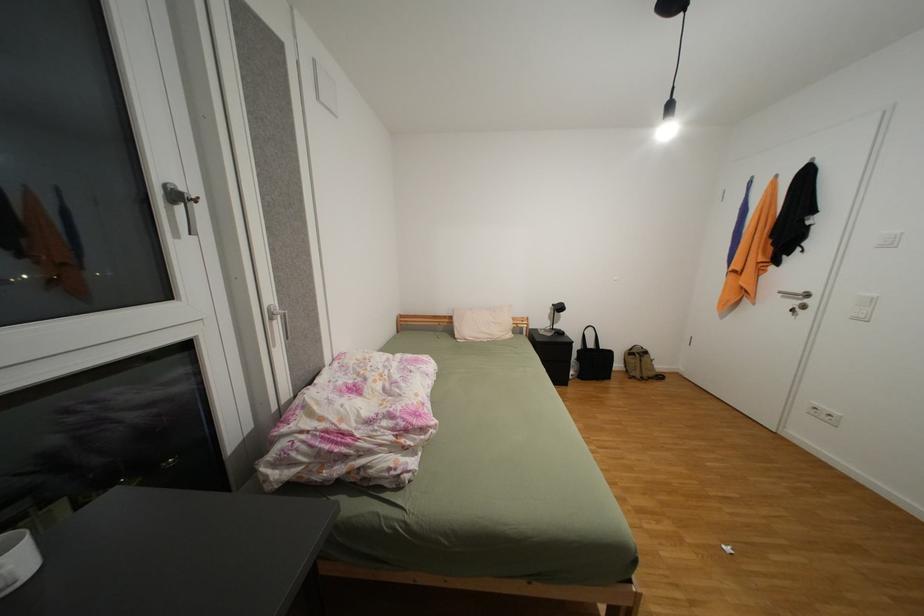
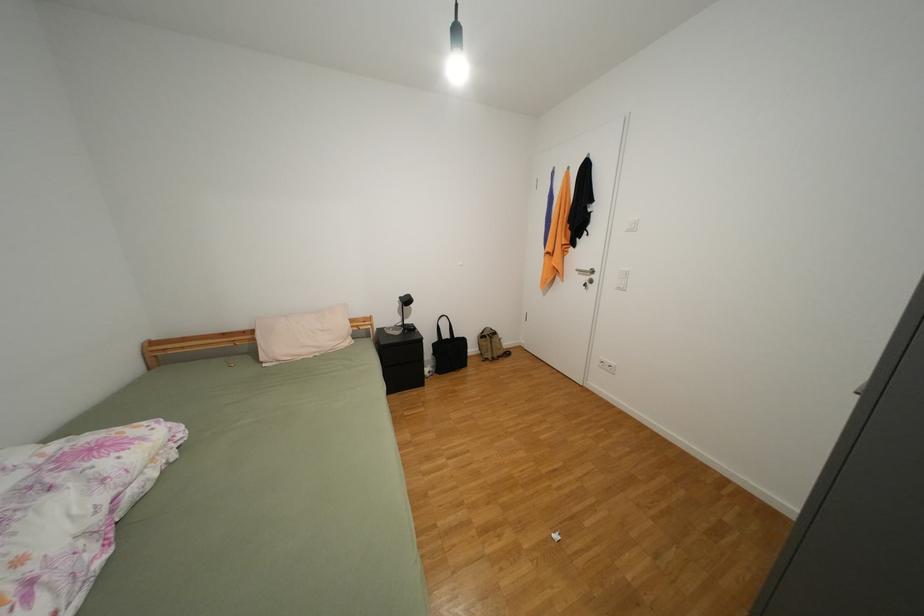
Question: The camera is either moving clockwise (left) or counter-clockwise (right) around the object. The first image is from the beginning of the video and the second image is from the end. Is the camera moving left or right when shooting the video?

Choices:
 (A) Left
 (B) Right

Answer: (A)